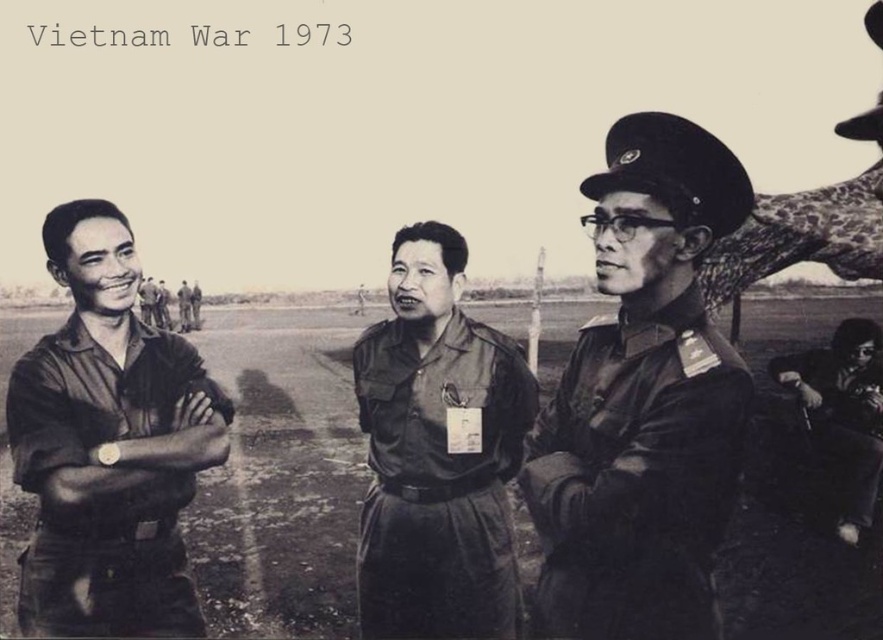
In the Vietnam War 1973 photograph, there are two uniforms at the center labeled as matte dark green uniform at center and matte khaki uniform at center. Which one is larger in size?

The matte dark green uniform at center is bigger than the matte khaki uniform at center.

You are a photographer standing at the center of the scene. You want to take a portrait of the matte khaki shirt at left and the matte khaki uniform at center. Given that your camera has a maximum focus range of 100 feet, will you be able to capture both subjects clearly in the same frame?

The distance between the matte khaki shirt at left and the matte khaki uniform at center is 96.32 feet. Since this distance is less than the camera maximum focus range of 100 feet, both subjects can be captured clearly in the same frame.